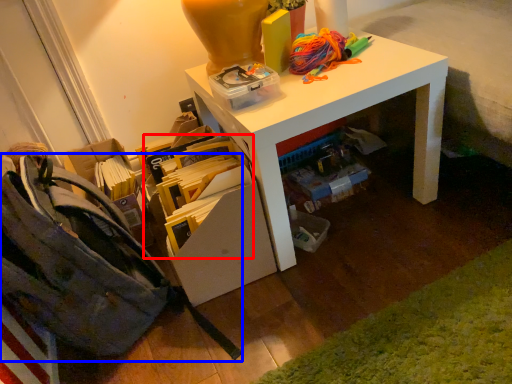
Question: Among these objects, which one is farthest to the camera, book (highlighted by a red box) or shoulder bag (highlighted by a blue box)?

Choices:
 (A) book
 (B) shoulder bag

Answer: (A)